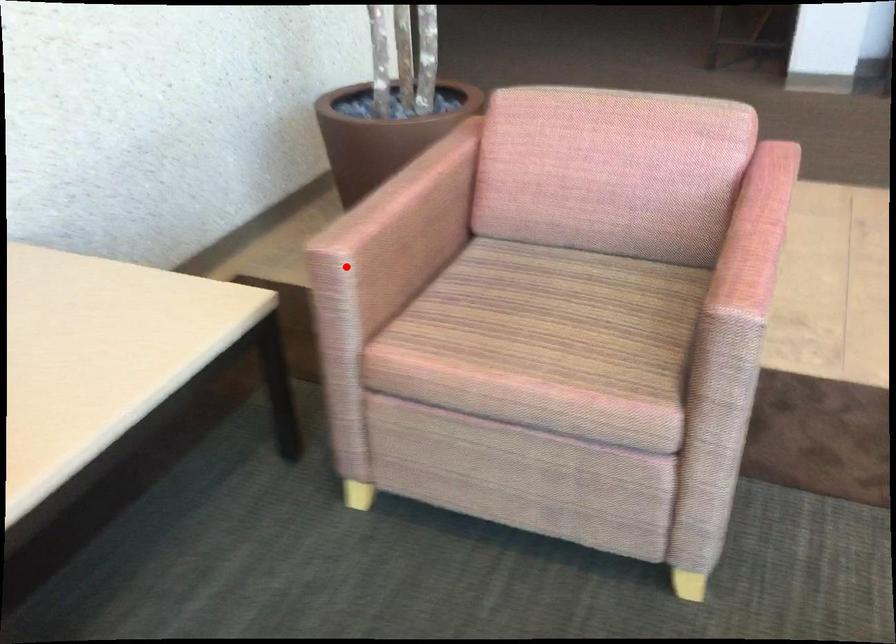
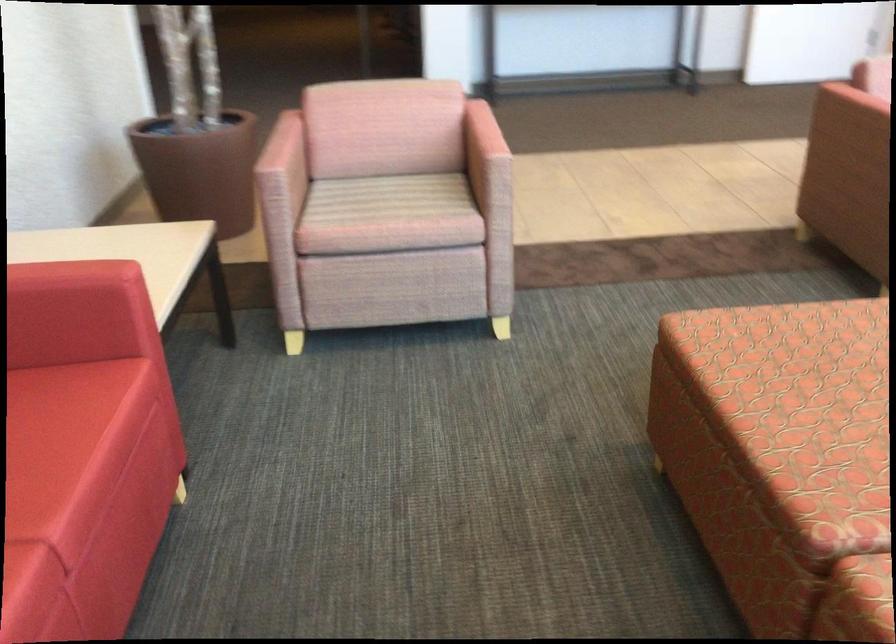
In the second image, find the point that corresponds to the highlighted location in the first image.

(280, 176)